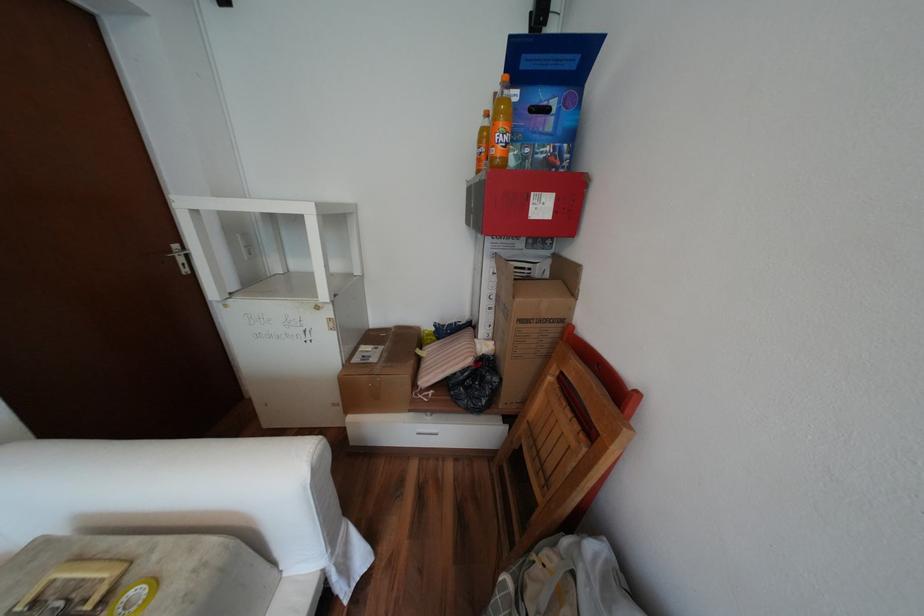
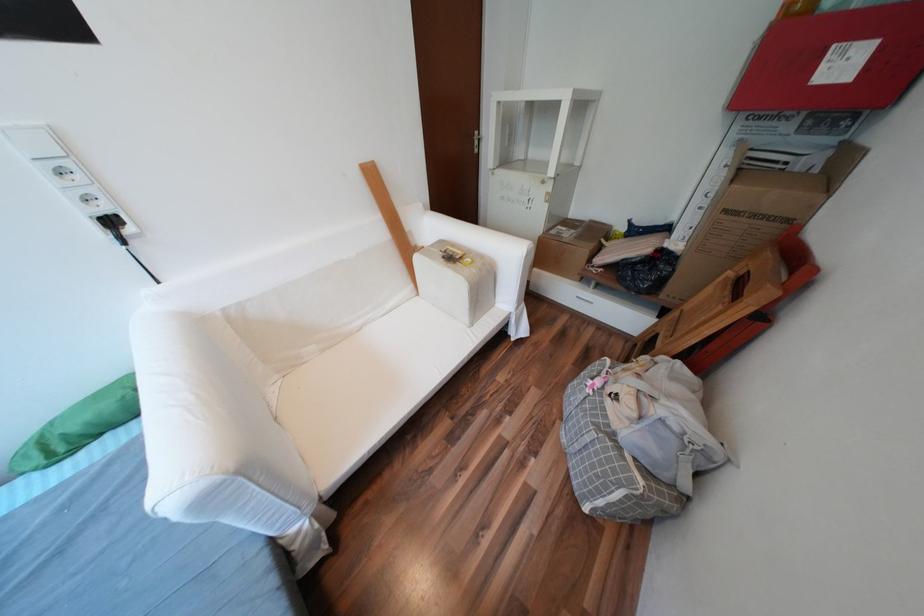
The point at (x=333, y=570) is marked in the first image. Where is the corresponding point in the second image?

(519, 313)